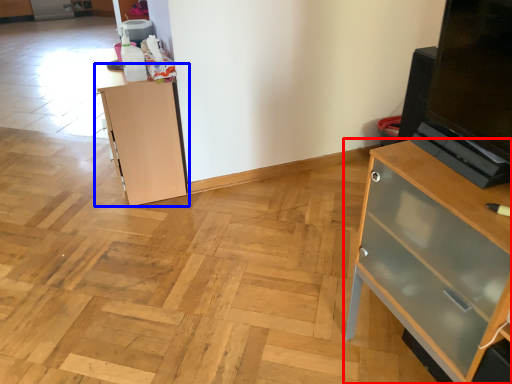
Question: Which point is further to the camera, chest of drawers (highlighted by a red box) or cupboard (highlighted by a blue box)?

Choices:
 (A) chest of drawers
 (B) cupboard

Answer: (B)